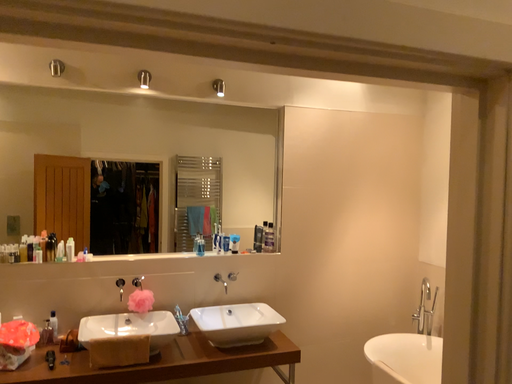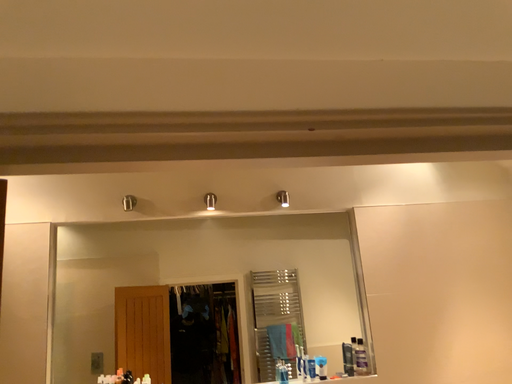
Question: Which way did the camera rotate in the video?

Choices:
 (A) rotated upward
 (B) rotated downward

Answer: (A)